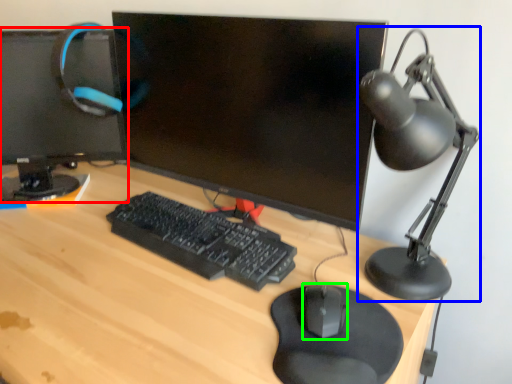
Question: Which object is the farthest from computer monitor (highlighted by a red box)? Choose among these: table lamp (highlighted by a blue box) or mouse (highlighted by a green box).

Choices:
 (A) table lamp
 (B) mouse

Answer: (B)